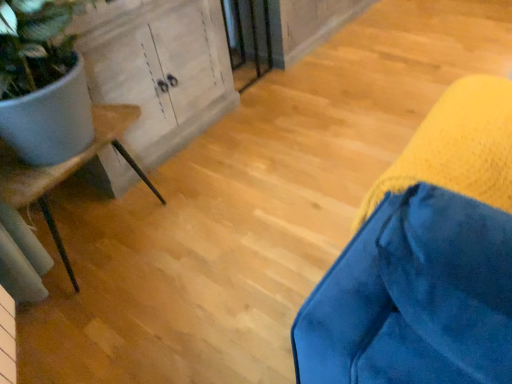
Find the location of a particular element. The image size is (512, 384). free space in front of wooden screen door at center is located at coordinates (260, 102).